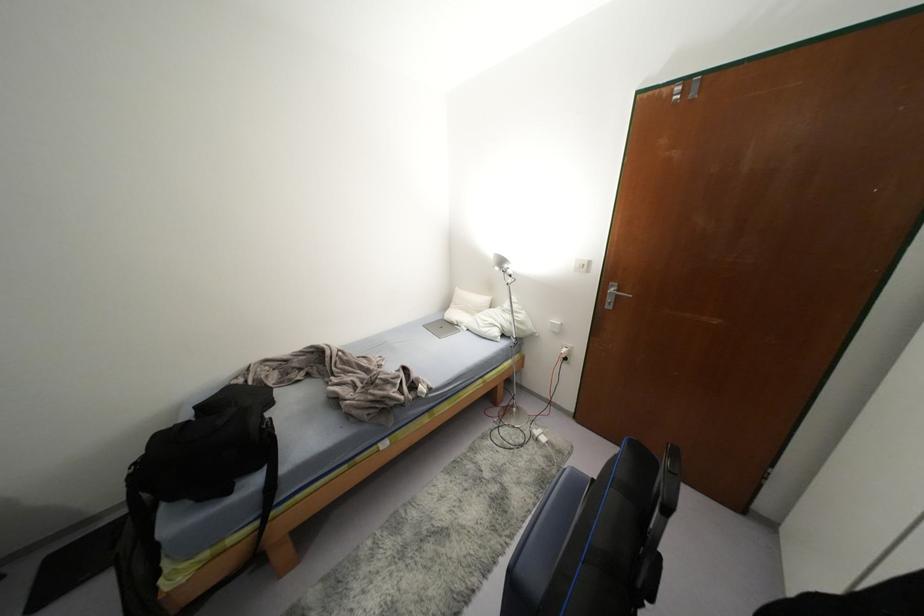
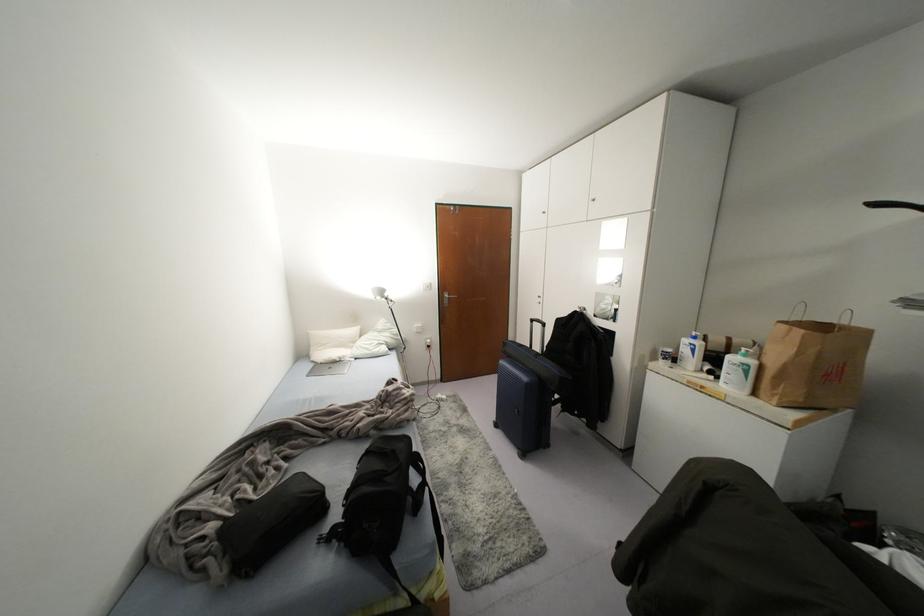
Locate, in the second image, the point that corresponds to point 484,299 in the first image.

(354, 330)